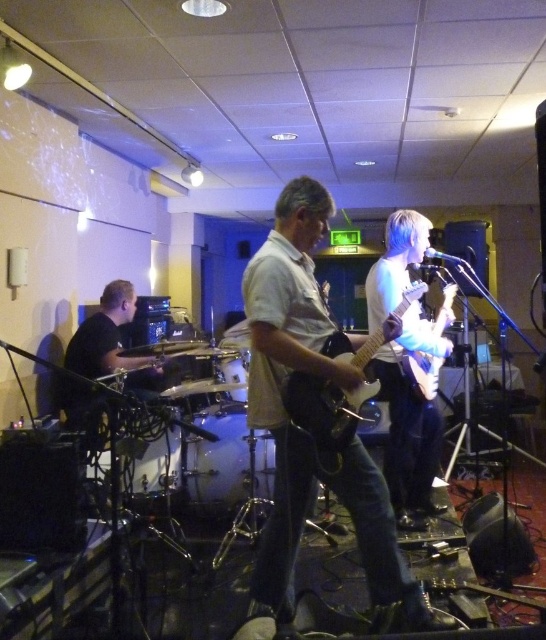
Who is positioned more to the right, white glossy electric guitar at center or clear glass drum at center?

white glossy electric guitar at center

Does white glossy electric guitar at center have a smaller size compared to clear glass drum at center?

No.

Identify the location of white glossy electric guitar at center. This screenshot has height=640, width=546. (325, 406).

The image size is (546, 640). In order to click on white glossy electric guitar at center in this screenshot , I will do `click(325, 406)`.

Which is in front, point (254, 355) or point (335, 348)?

Positioned in front is point (335, 348).

Who is more forward, (365, 506) or (375, 394)?

Point (365, 506) is in front.

Identify the location of light brown leather guitar at center. Image resolution: width=546 pixels, height=640 pixels. (302, 432).

Is clear glass drum at center above smooth black drum at center?

Actually, clear glass drum at center is below smooth black drum at center.

Which is behind, point (235, 486) or point (124, 433)?

The point (235, 486) is behind.

Image resolution: width=546 pixels, height=640 pixels. I want to click on clear glass drum at center, so click(218, 464).